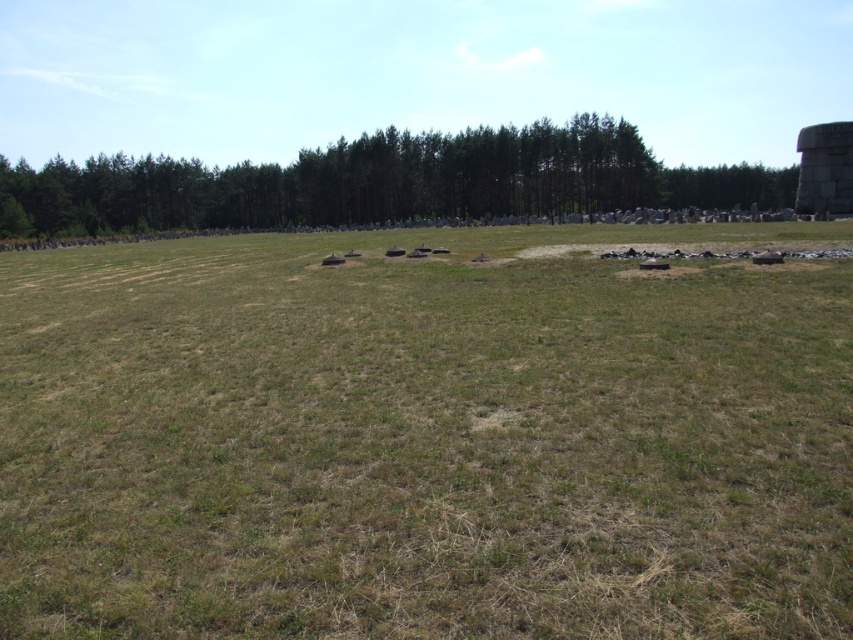
Question: Does green grass at center come behind green leafy trees at center?

Choices:
 (A) no
 (B) yes

Answer: (A)

Question: Does green grass at center have a lesser width compared to green leafy trees at center?

Choices:
 (A) no
 (B) yes

Answer: (B)

Question: Observing the image, what is the correct spatial positioning of green grass at center in reference to green leafy trees at center?

Choices:
 (A) left
 (B) right

Answer: (B)

Question: Which point is closer to the camera?

Choices:
 (A) [x=25, y=198]
 (B) [x=9, y=451]

Answer: (B)